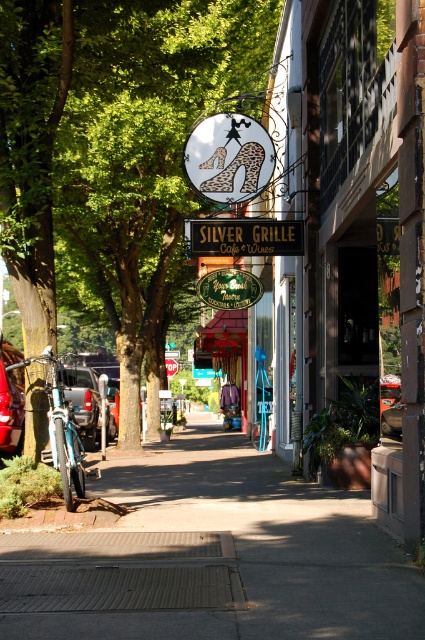
Question: Which object is farther from the camera taking this photo?

Choices:
 (A) concrete sidewalk at center
 (B) matte silver suv at left
 (C) metallic silver car at left

Answer: (B)

Question: Which object is closer to the camera taking this photo?

Choices:
 (A) matte silver suv at left
 (B) gold metallic sign at center

Answer: (B)

Question: Can you confirm if concrete sidewalk at center is smaller than metallic silver car at center?

Choices:
 (A) yes
 (B) no

Answer: (B)

Question: Can you confirm if green leafy tree at center is thinner than metallic silver car at center?

Choices:
 (A) no
 (B) yes

Answer: (A)

Question: Does green leafy tree at center have a larger size compared to metallic silver car at center?

Choices:
 (A) yes
 (B) no

Answer: (A)

Question: Which of the following is the closest to the observer?

Choices:
 (A) (271, 618)
 (B) (144, 326)
 (C) (5, 376)
 (D) (110, 396)

Answer: (A)